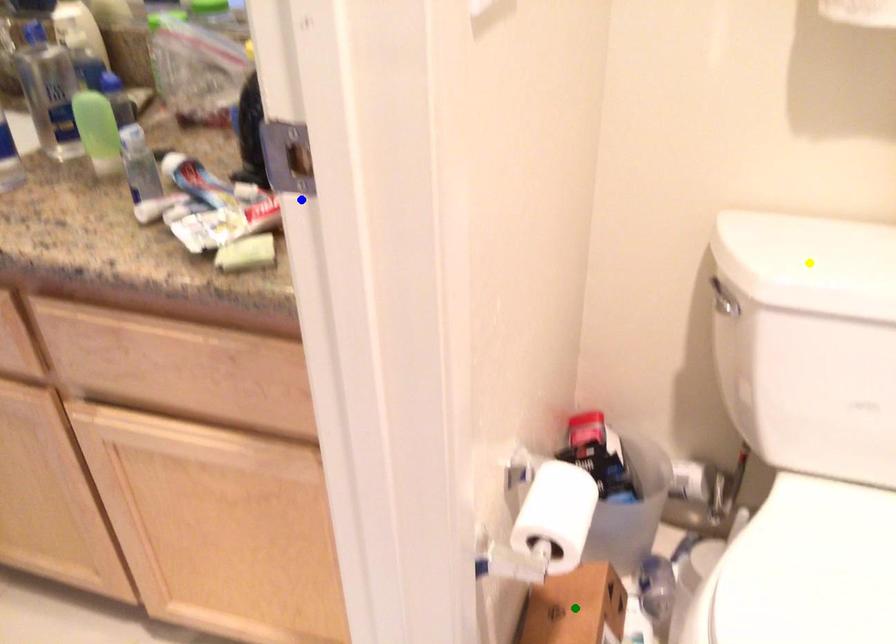
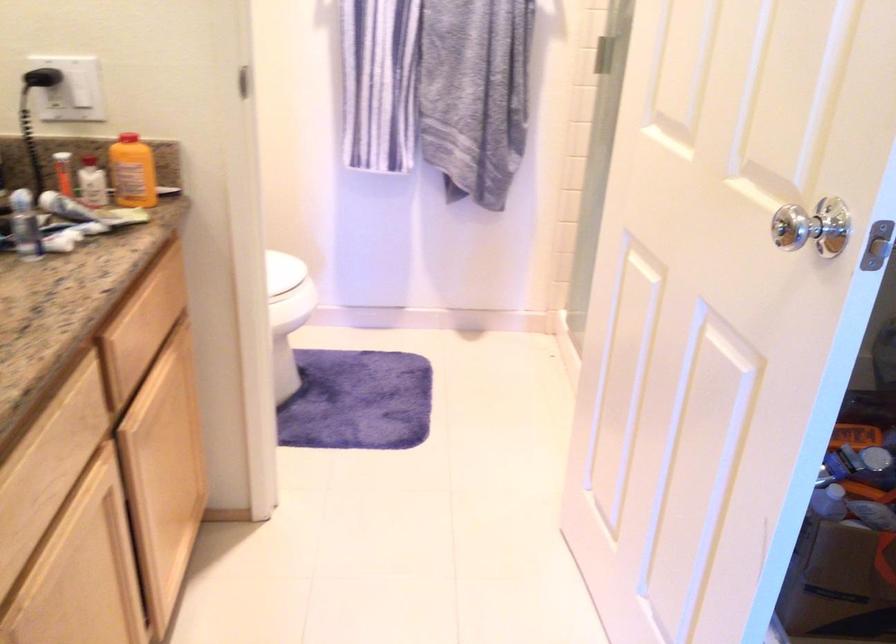
I am providing you with two images of the same scene from different viewpoints. Three points are marked in image1. Which point corresponds to a part or object that is occluded in image2?In image1, three points are marked. Which of them correspond to a part or object that is occluded in image2?Among the three points shown in image1, which one corresponds to a part or object that is no longer visible due to occlusion in image2?

Invisible in image2: yellow point, green point.